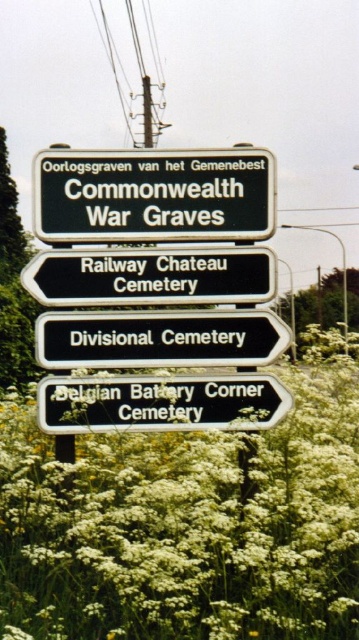
Can you confirm if white fluffy flowers at center is positioned to the right of black plastic sign at center?

Incorrect, white fluffy flowers at center is not on the right side of black plastic sign at center.

Who is higher up, white fluffy flowers at center or black plastic sign at center?

black plastic sign at center is higher up.

Is point (38, 618) more distant than point (90, 289)?

No, (38, 618) is in front of (90, 289).

What are the coordinates of `white fluffy flowers at center` in the screenshot? It's located at (189, 522).

Does point (159, 348) lie behind point (123, 426)?

Yes, point (159, 348) is farther from viewer.

Does black metal sign at center have a lesser width compared to green plastic sign at lower right?

No.

You are a GUI agent. You are given a task and a screenshot of the screen. Output one action in this format:
    pyautogui.click(x=<x>, y=<y>)
    Task: Click on the black metal sign at center
    The height and width of the screenshot is (640, 359).
    Given the screenshot: What is the action you would take?
    pyautogui.click(x=159, y=339)

Is point (45, 544) positioned after point (164, 326)?

No, it is in front of (164, 326).

Is point (127, 557) closer to camera compared to point (159, 356)?

Yes, point (127, 557) is in front of point (159, 356).

At what (x,y) coordinates should I click in order to perform the action: click on white fluffy flowers at center. Please return your answer as a coordinate pair (x, y). Image resolution: width=359 pixels, height=640 pixels. Looking at the image, I should click on (189, 522).